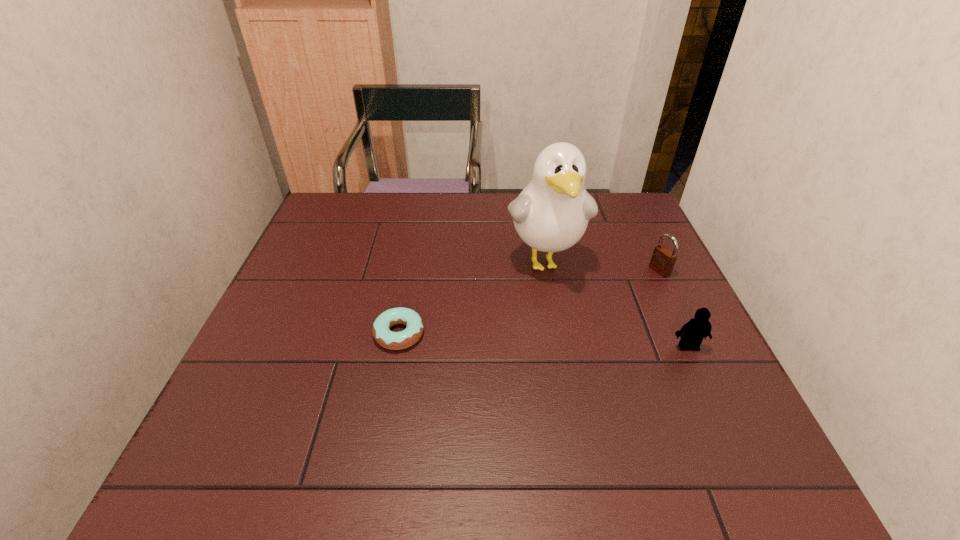
Where is `free space on the desktop that is between the leftmost object and the Lego and is positioned on the beak of the tallest object`? This screenshot has height=540, width=960. free space on the desktop that is between the leftmost object and the Lego and is positioned on the beak of the tallest object is located at coordinates (569, 341).

Identify the location of free space on the desktop that is between the doughnut and the Lego and is positioned on the front-facing side of the padlock. (512, 339).